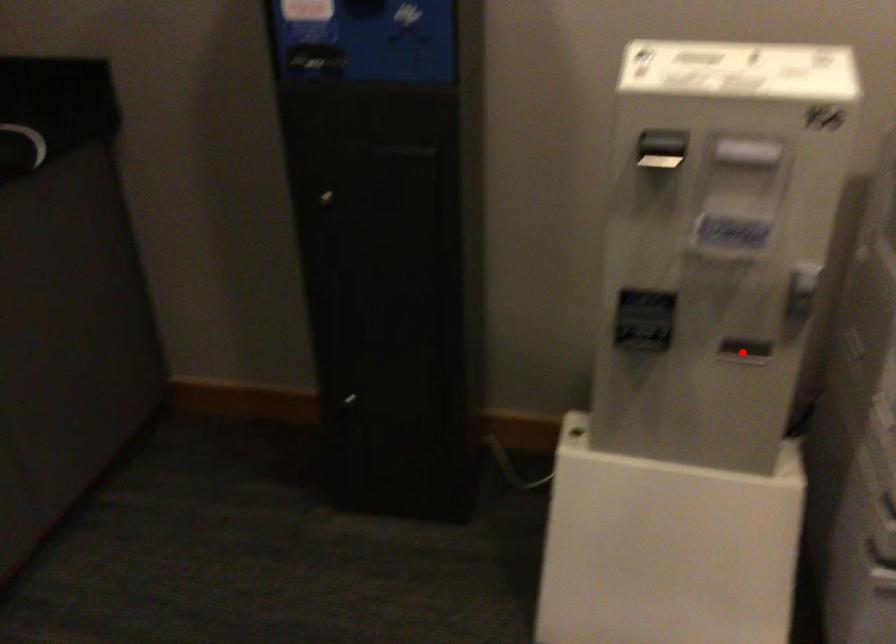
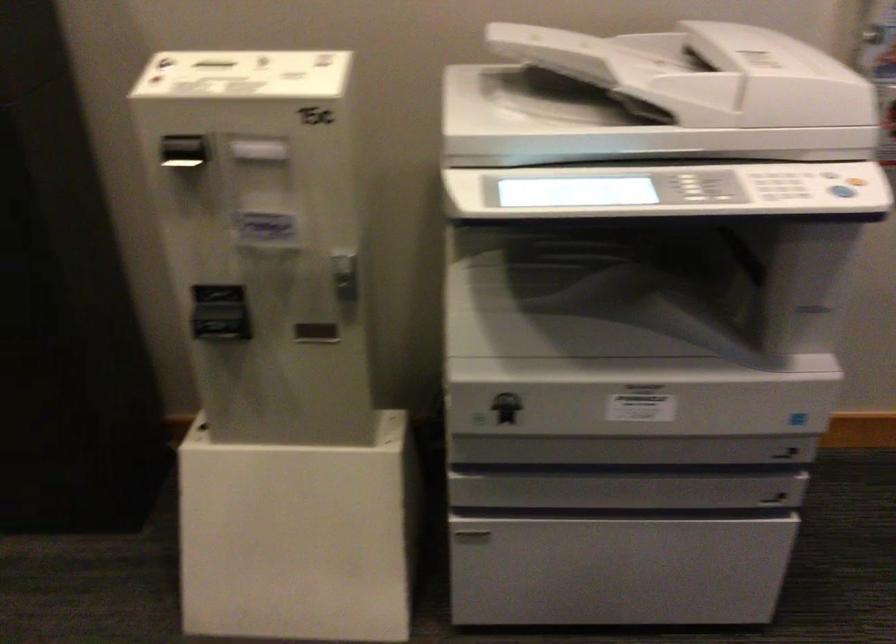
Where in the second image is the point corresponding to the highlighted location from the first image?

(315, 333)